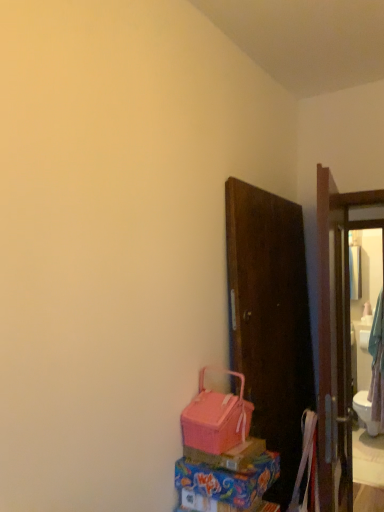
Question: Can you confirm if pink fabric basket at lower center is bigger than matte glass mirror at right?

Choices:
 (A) yes
 (B) no

Answer: (B)

Question: Does pink fabric basket at lower center lie in front of matte glass mirror at right?

Choices:
 (A) yes
 (B) no

Answer: (A)

Question: Does pink fabric basket at lower center have a lesser width compared to matte glass mirror at right?

Choices:
 (A) no
 (B) yes

Answer: (B)

Question: Is pink fabric basket at lower center located outside matte glass mirror at right?

Choices:
 (A) yes
 (B) no

Answer: (A)

Question: From the image's perspective, is pink fabric basket at lower center beneath matte glass mirror at right?

Choices:
 (A) yes
 (B) no

Answer: (B)

Question: Is pink fabric basket at lower center surrounding matte glass mirror at right?

Choices:
 (A) yes
 (B) no

Answer: (B)

Question: From the image's perspective, would you say matte glass mirror at right is shown under matte pink plastic box at lower center, which ranks as the 1th box in bottom-to-top order?

Choices:
 (A) yes
 (B) no

Answer: (A)

Question: Is matte glass mirror at right not close to matte pink plastic box at lower center, which ranks as the 1th box in bottom-to-top order?

Choices:
 (A) no
 (B) yes

Answer: (B)

Question: Does matte glass mirror at right appear on the right side of matte pink plastic box at lower center, which ranks as the 1th box in bottom-to-top order?

Choices:
 (A) no
 (B) yes

Answer: (B)

Question: Is matte glass mirror at right located outside matte pink plastic box at lower center, which is the second box in top-to-bottom order?

Choices:
 (A) yes
 (B) no

Answer: (A)

Question: Does matte glass mirror at right lie in front of matte pink plastic box at lower center, which ranks as the 1th box in bottom-to-top order?

Choices:
 (A) no
 (B) yes

Answer: (A)

Question: Is the position of matte glass mirror at right more distant than that of matte pink plastic box at lower center, which is the second box in top-to-bottom order?

Choices:
 (A) no
 (B) yes

Answer: (B)

Question: Is matte pink plastic box at lower center, which is the second box in top-to-bottom order, behind pink plastic box at lower center, arranged as the 1th box when viewed from the top?

Choices:
 (A) yes
 (B) no

Answer: (B)